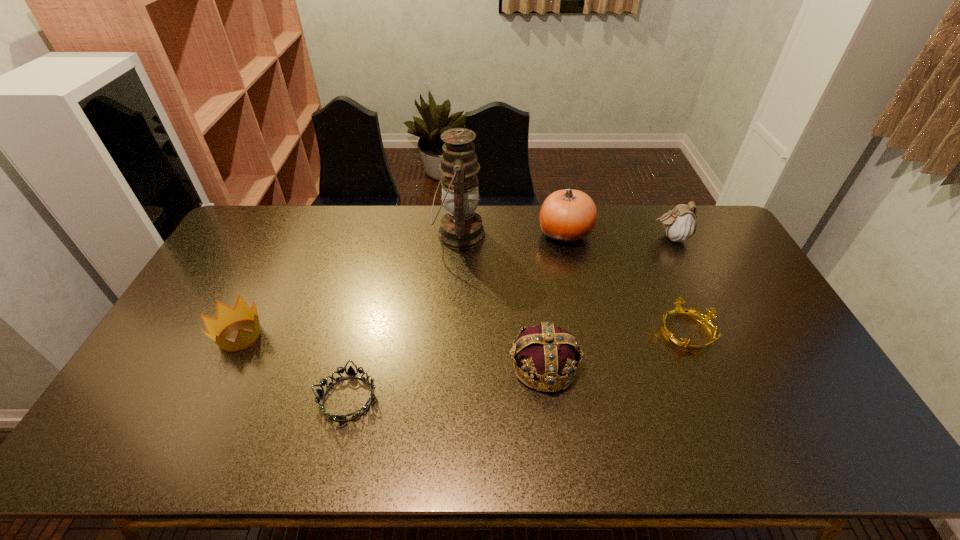
At what (x,y) coordinates should I click in order to perform the action: click on free space between the leftmost crown and the shortest crown. Please return your answer as a coordinate pair (x, y). The width and height of the screenshot is (960, 540). Looking at the image, I should click on (463, 333).

Identify the location of object that ranks as the fourth closest to the second tallest object. (546, 352).

Locate an element on the screen. The image size is (960, 540). the third closest object to the lantern is located at coordinates (350, 373).

Locate which crown ranks second in proximity to the sixth shortest object. Please provide its 2D coordinates. Your answer should be formatted as a tuple, i.e. [(x, y)], where the tuple contains the x and y coordinates of a point satisfying the conditions above.

[(546, 352)]

The width and height of the screenshot is (960, 540). In order to click on crown object that ranks as the second closest to the tiara in this screenshot , I will do `click(546, 352)`.

This screenshot has width=960, height=540. I want to click on free point that satisfies the following two spatial constraints: 1. on the front side of the third object from left to right; 2. on the front-facing side of the second object from left to right, so point(450,398).